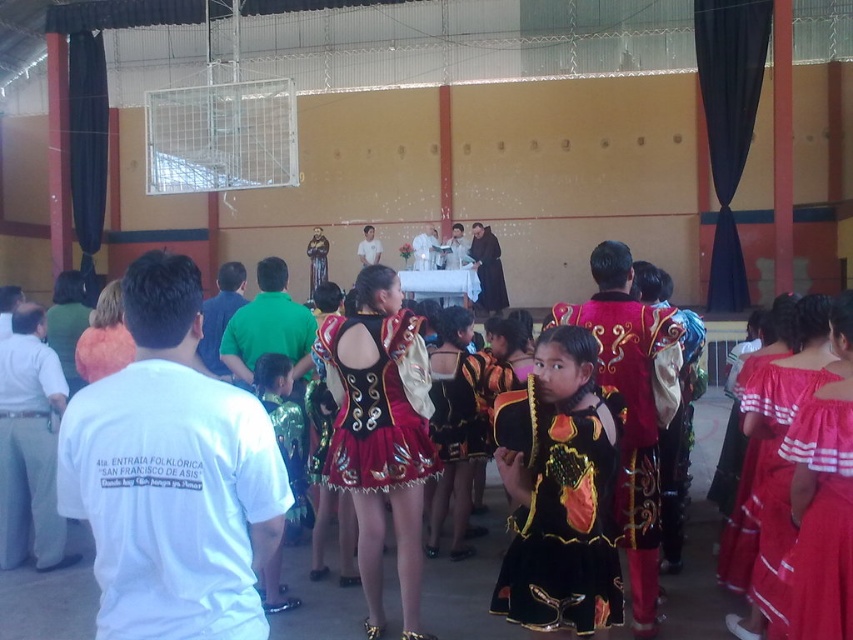
You are a photographer at the event and want to capture both the shiny gold fabric dress at center and the red cotton dress at right in the same frame. Which dress should you focus on first to ensure both are in the shot?

You should focus on the shiny gold fabric dress at center first because it is positioned to the left of the red cotton dress at right, so centering the camera between them would include both in the frame.

You are a photographer standing at the entrance of the hall and want to capture both the red cotton dress at right and the shiny metallic skirt at center in a single photo. The camera you have can only focus on objects within a 10 feet range. Will both subjects be in focus?

The distance between the red cotton dress at right and the shiny metallic skirt at center is 9.05 feet, which is within the 10 feet range of the camera. Therefore, both subjects will be in focus.